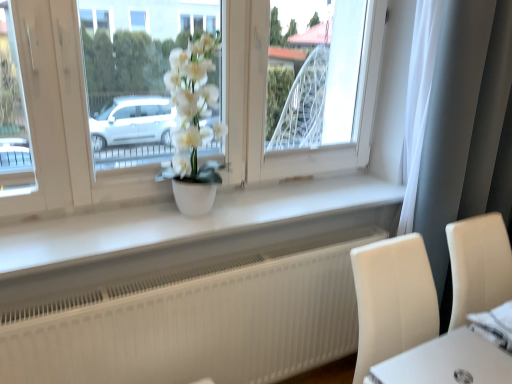
Describe the element at coordinates (466, 131) in the screenshot. I see `white sheer curtain at right` at that location.

Find the location of a particular element. The image size is (512, 384). white matte window sill at center is located at coordinates (198, 222).

At what (x,y) coordinates should I click in order to perform the action: click on white glossy round table at lower right. Please return your answer as a coordinate pair (x, y). Image resolution: width=512 pixels, height=384 pixels. Looking at the image, I should click on (447, 362).

I want to click on white fabric at lower right, so click(495, 325).

The height and width of the screenshot is (384, 512). I want to click on white sheer curtain at right, so coord(466,131).

Which of these two, white matte window sill at center or white fabric at lower right, is smaller?

Smaller between the two is white fabric at lower right.

Is white fabric at lower right at the back of white matte window sill at center?

That's not correct — white matte window sill at center is not looking away from white fabric at lower right.

From a real-world perspective, between white matte window sill at center and white fabric at lower right, who is vertically higher?

From a 3D spatial view, white matte window sill at center is above.

Is white matte window sill at center at the right side of white fabric at lower right?

Incorrect, white matte window sill at center is not on the right side of white fabric at lower right.

How distant is white glossy round table at lower right from white matte window sill at center?

white glossy round table at lower right and white matte window sill at center are 76.80 centimeters apart from each other.

Is point (471, 364) in front of point (238, 234)?

Yes.

From the image's perspective, is white glossy round table at lower right above white matte window sill at center?

No, from the image's perspective, white glossy round table at lower right is not above white matte window sill at center.

Does white glossy round table at lower right have a lesser height compared to white matte window sill at center?

Correct, white glossy round table at lower right is not as tall as white matte window sill at center.

Which object is further away from the camera, white fabric at lower right or white glossy round table at lower right?

white fabric at lower right is more distant.

From a real-world perspective, who is located lower, white fabric at lower right or white glossy round table at lower right?

In real-world perspective, white fabric at lower right is lower.

Which is farther, (475, 329) or (387, 374)?

The point (475, 329) is behind.

From the image's perspective, is white fabric at lower right positioned above or below white glossy round table at lower right?

white fabric at lower right is situated higher than white glossy round table at lower right in the image.

Which object is more forward, white fabric at lower right or white matte flower pot at center?

white fabric at lower right is in front.

From a real-world perspective, who is located lower, white fabric at lower right or white matte flower pot at center?

From a 3D spatial view, white fabric at lower right is below.

Considering the sizes of objects white fabric at lower right and white matte flower pot at center in the image provided, who is thinner, white fabric at lower right or white matte flower pot at center?

white matte flower pot at center is thinner.

Considering the relative sizes of white fabric at lower right and white matte flower pot at center in the image provided, is white fabric at lower right shorter than white matte flower pot at center?

Yes, white fabric at lower right is shorter than white matte flower pot at center.

Is white matte flower pot at center bigger than white fabric at lower right?

Indeed, white matte flower pot at center has a larger size compared to white fabric at lower right.

The height and width of the screenshot is (384, 512). In the image, there is a white matte flower pot at center. In order to click on tablecloth below it (from the image's perspective) in this screenshot , I will do `click(495, 325)`.

Is white matte flower pot at center surrounding white fabric at lower right?

No, white fabric at lower right is not inside white matte flower pot at center.

Locate an element on the screen. round table located in front of the white matte flower pot at center is located at coordinates click(447, 362).

In the scene shown: Can you confirm if white matte flower pot at center is bigger than white glossy round table at lower right?

Correct, white matte flower pot at center is larger in size than white glossy round table at lower right.

In terms of height, does white matte flower pot at center look taller or shorter compared to white glossy round table at lower right?

white matte flower pot at center is taller than white glossy round table at lower right.

In the scene shown: Is white matte flower pot at center oriented towards white glossy round table at lower right?

Yes, white matte flower pot at center faces towards white glossy round table at lower right.

From a real-world perspective, which object rests below the other?

In real-world perspective, white matte window sill at center is lower.

Could you tell me if white sheer curtain at right is facing white matte window sill at center?

No, white sheer curtain at right is not facing towards white matte window sill at center.

Would you consider white sheer curtain at right to be distant from white matte window sill at center?

white sheer curtain at right is actually quite close to white matte window sill at center.

At what (x,y) coordinates should I click in order to perform the action: click on tablecloth that is under the white matte window sill at center (from a real-world perspective). Please return your answer as a coordinate pair (x, y). Image resolution: width=512 pixels, height=384 pixels. Looking at the image, I should click on (495, 325).

At what (x,y) coordinates should I click in order to perform the action: click on window sill above the white glossy round table at lower right (from a real-world perspective). Please return your answer as a coordinate pair (x, y). Looking at the image, I should click on (198, 222).

From the image, which object appears to be nearer to white glossy round table at lower right, white matte flower pot at center or white matte window sill at center?

white matte window sill at center is positioned closer to the anchor white glossy round table at lower right.

Based on their spatial positions, is white sheer curtain at right or white matte flower pot at center further from white glossy round table at lower right?

white matte flower pot at center is positioned further to the anchor white glossy round table at lower right.

From the image, which object appears to be nearer to white matte pot at center, white matte flower pot at center or white glossy round table at lower right?

white matte flower pot at center is positioned closer to the anchor white matte pot at center.

Estimate the real-world distances between objects in this image. Which object is further from white sheer curtain at right, white fabric at lower right or white matte pot at center?

Among the two, white matte pot at center is located further to white sheer curtain at right.

When comparing their distances from white matte flower pot at center, does white glossy round table at lower right or white sheer curtain at right seem closer?

The object closer to white matte flower pot at center is white sheer curtain at right.

Which object lies further to the anchor point white matte window sill at center, white fabric at lower right or white sheer curtain at right?

Based on the image, white fabric at lower right appears to be further to white matte window sill at center.

In the scene shown: Considering their positions, is white matte flower pot at center positioned further to white matte window sill at center than white glossy round table at lower right?

Based on the image, white glossy round table at lower right appears to be further to white matte window sill at center.

From the image, which object appears to be farther from white fabric at lower right, white matte pot at center or white matte window sill at center?

Among the two, white matte pot at center is located further to white fabric at lower right.

This screenshot has height=384, width=512. What are the coordinates of `window sill between white matte flower pot at center and white glossy round table at lower right in the vertical direction` in the screenshot? It's located at (198, 222).

Find the location of a particular element. window located between white matte pot at center and white fabric at lower right in the left-right direction is located at coordinates (62, 118).

Locate an element on the screen. round table between white matte flower pot at center and white sheer curtain at right is located at coordinates (447, 362).

In order to click on window sill situated between white matte flower pot at center and white sheer curtain at right from left to right in this screenshot , I will do `click(198, 222)`.